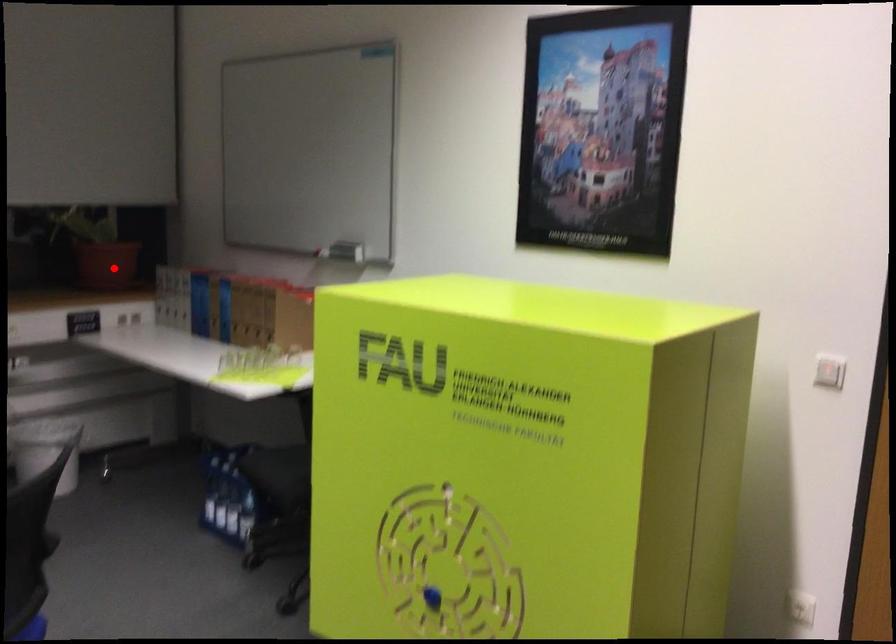
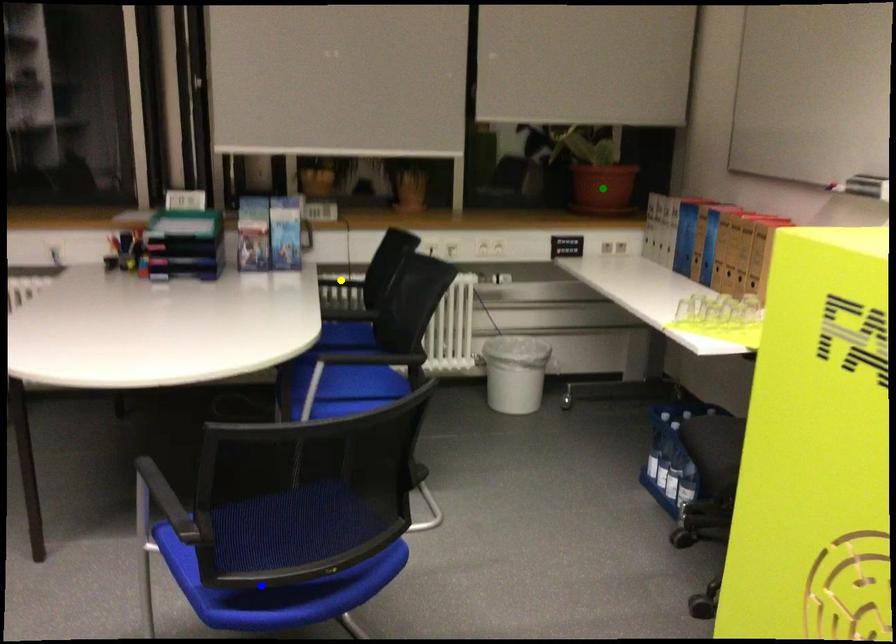
Question: I am providing you with two images of the same scene from different viewpoints. A red point is marked on the first image. You are given multiple points on the second image. Which point in image 2 is actually the same real-world point as the red point in image 1?

Choices:
 (A) yellow point
 (B) blue point
 (C) green point

Answer: (C)